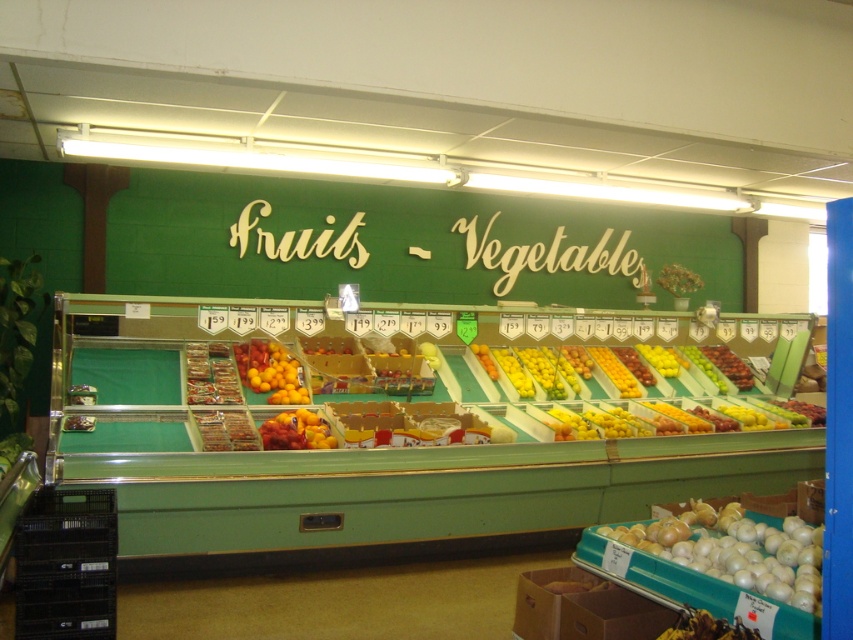
Can you confirm if shiny red grapes at center is positioned above yellow matte lemon at center?

No, shiny red grapes at center is not above yellow matte lemon at center.

Looking at this image, who is positioned more to the right, shiny red grapes at center or yellow matte lemon at center?

From the viewer's perspective, shiny red grapes at center appears more on the right side.

Who is more forward, (703, 352) or (650, 358)?

Positioned in front is point (650, 358).

Where is `shiny red grapes at center`? Image resolution: width=853 pixels, height=640 pixels. shiny red grapes at center is located at coordinates (729, 365).

How far apart are white glossy onion at lower right and shiny yellow-orange citrus at center?

white glossy onion at lower right is 3.27 meters from shiny yellow-orange citrus at center.

Between point (799, 564) and point (277, 394), which one is positioned behind?

The point (277, 394) is more distant.

Where is `white glossy onion at lower right`? The width and height of the screenshot is (853, 640). white glossy onion at lower right is located at coordinates (735, 550).

What do you see at coordinates (735, 550) in the screenshot? The image size is (853, 640). I see `white glossy onion at lower right` at bounding box center [735, 550].

Does point (656, 552) come in front of point (651, 348)?

Yes, point (656, 552) is closer to viewer.

What are the coordinates of `white glossy onion at lower right` in the screenshot? It's located at tap(735, 550).

The height and width of the screenshot is (640, 853). In order to click on white glossy onion at lower right in this screenshot , I will do `click(735, 550)`.